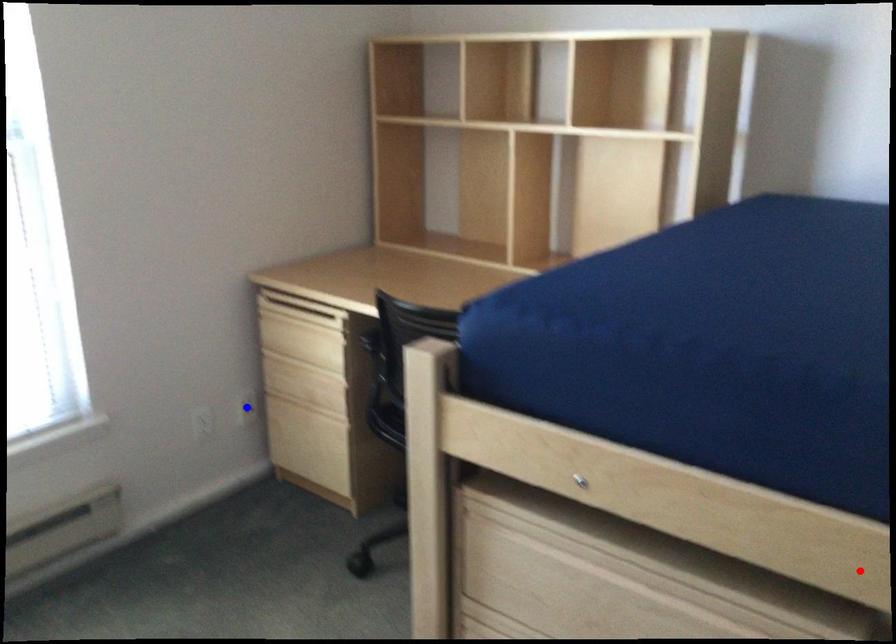
Question: Two points are marked on the image. Which point is closer to the camera?

Choices:
 (A) Blue point is closer.
 (B) Red point is closer.

Answer: (B)